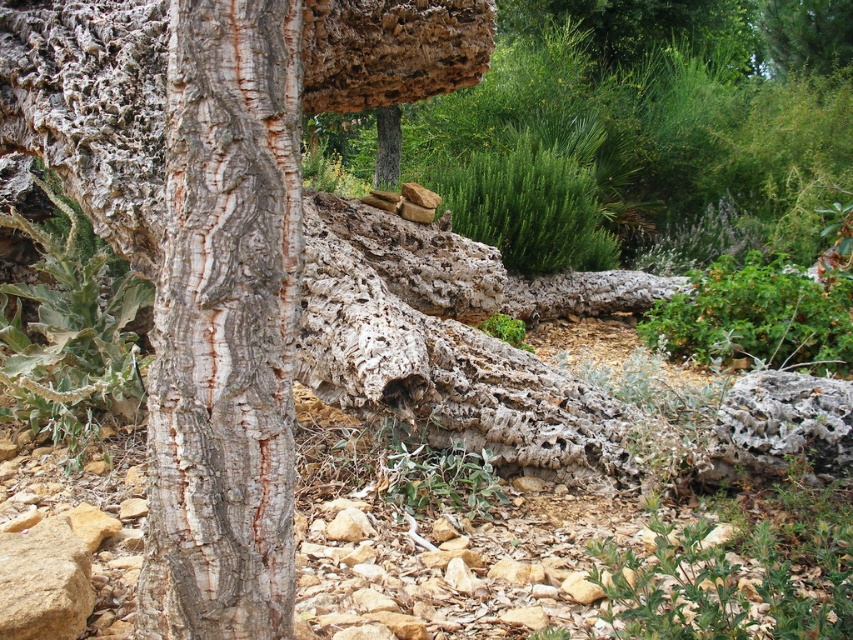
Question: Which point appears farthest from the camera in this image?

Choices:
 (A) (520, 348)
 (B) (212, 467)

Answer: (A)

Question: Does gray rough bark at center have a larger size compared to green leafy plant at center?

Choices:
 (A) yes
 (B) no

Answer: (B)

Question: Does gray rough bark at center appear under green leafy plant at center?

Choices:
 (A) no
 (B) yes

Answer: (A)

Question: Can you confirm if gray rough bark at center is bigger than green leafy plant at center?

Choices:
 (A) no
 (B) yes

Answer: (A)

Question: Which object is farther from the camera taking this photo?

Choices:
 (A) green leafy plant at center
 (B) gray rough bark at center

Answer: (A)